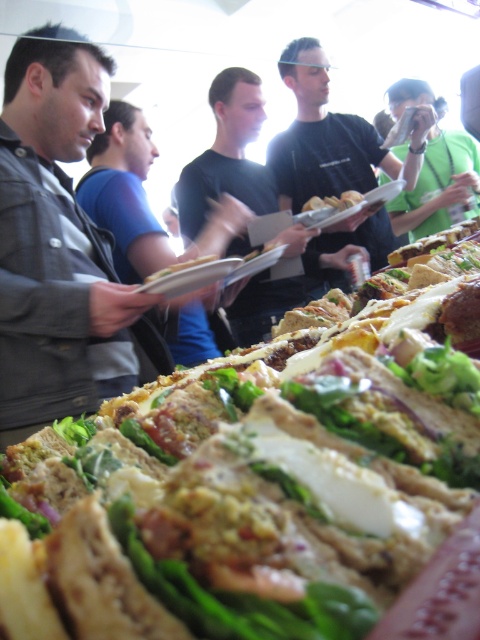
You are at the buffet and need to find the dark gray jacket at left. According to the spatial description, where exactly is it positioned?

The dark gray jacket at left is located at point (59, 244).

You are a guest at the buffet and want to take a photo with the dark gray jacket at left and the green fabric shirt at upper right in the background. Which of the two should be positioned closer to the camera to ensure both are in the frame?

The dark gray jacket at left should be positioned closer to the camera because it is already to the left of the green fabric shirt at upper right, so adjusting their positions slightly can help frame both in the photo.